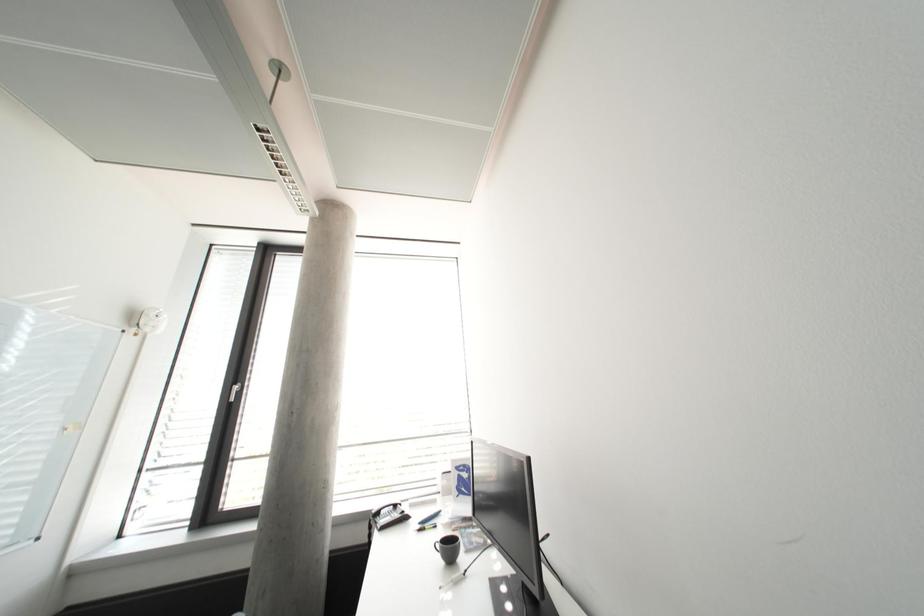
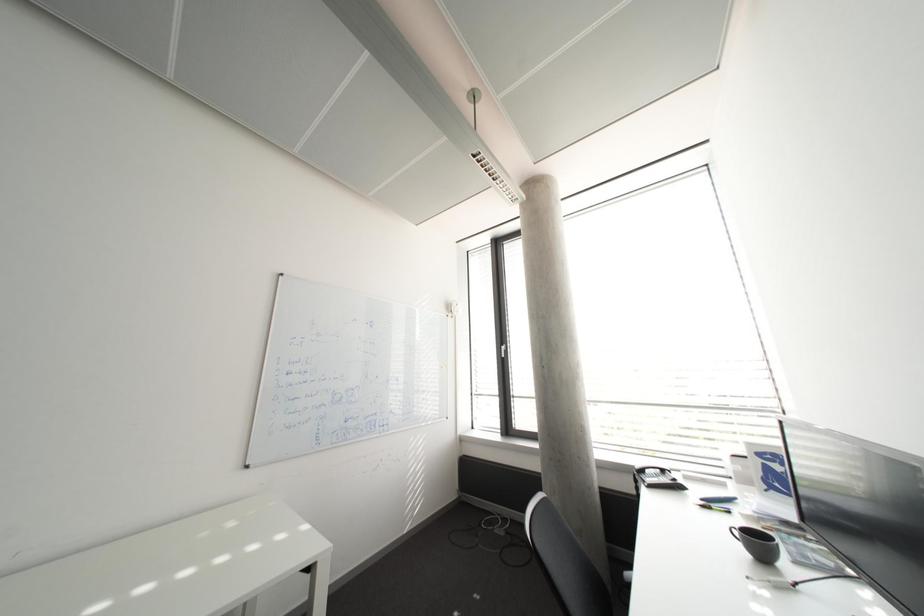
Question: The camera is either moving clockwise (left) or counter-clockwise (right) around the object. The first image is from the beginning of the video and the second image is from the end. Is the camera moving left or right when shooting the video?

Choices:
 (A) Left
 (B) Right

Answer: (B)